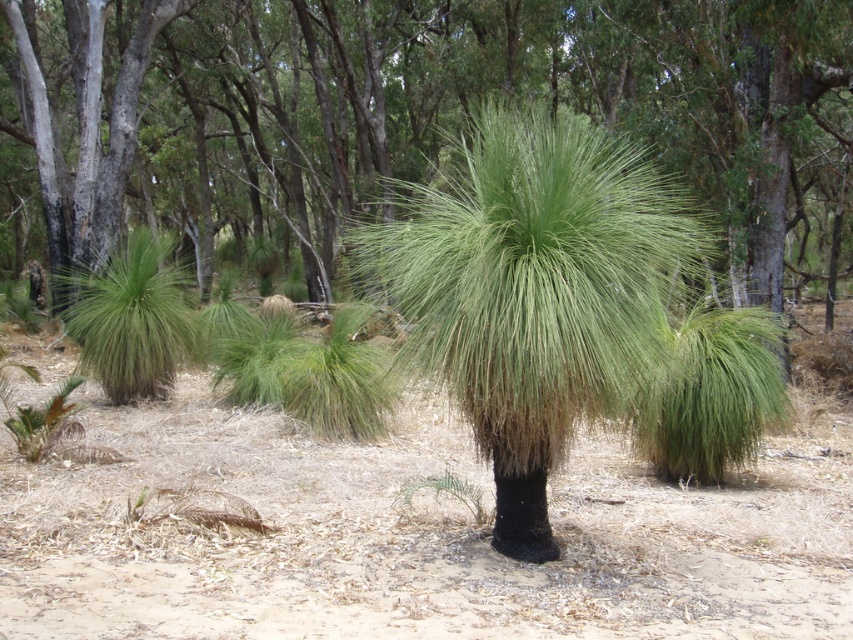
You are standing at the point labeled point at (775, 33). You want to walk to the nearest eucalyptus tree. How far will you have to walk?

The distance between the point at (775, 33) and the nearest eucalyptus tree is 41.96 feet, so you will have to walk 41.96 feet.

You are standing at the point marked as point (663, 106) in the image. The distance between you and the viewer is 52.01 feet. If you want to walk towards the dense collection of eucalyptus trees in the background, which direction should you head?

Since the point (663, 106) is 52.01 feet away from the viewer, and the dense collection of eucalyptus trees are in the background, you should head in the direction away from the viewer to reach the eucalyptus trees.

What are the coordinates of the green fibrous palm tree at center?

The green fibrous palm tree at center is located at coordinates point (x=537, y=292).